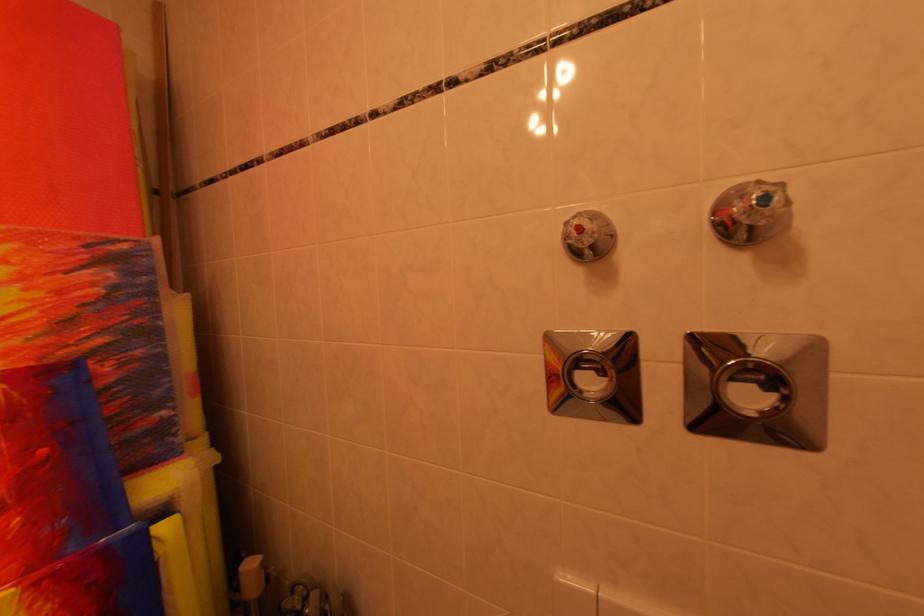
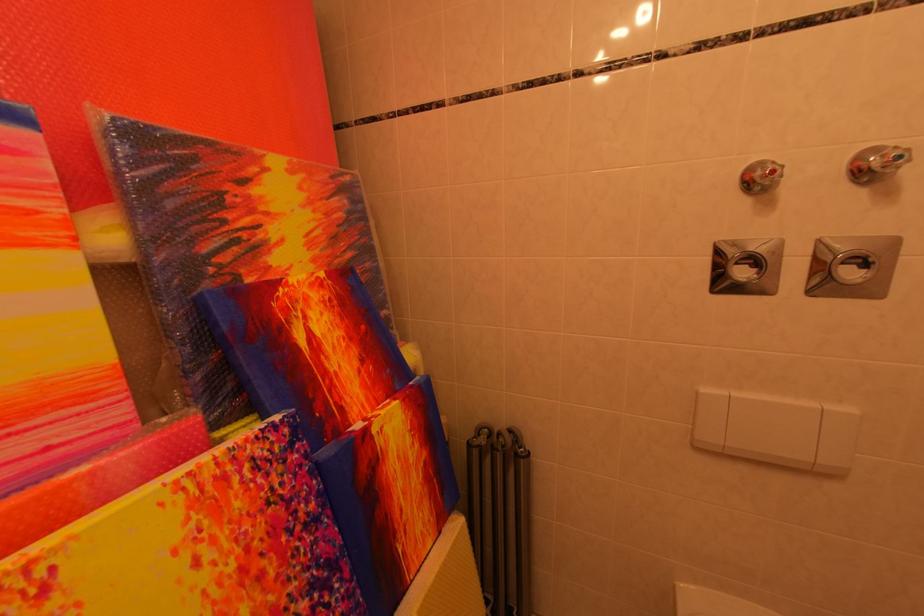
In the second image, find the point that corresponds to point 773,201 in the first image.

(907, 161)